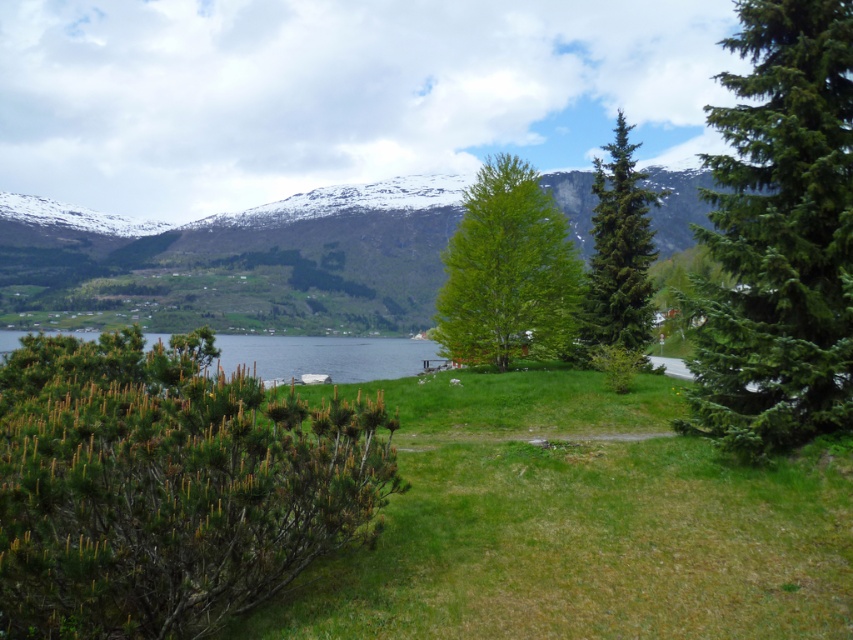
Question: Is green needle-like at left bigger than green coniferous tree at center?

Choices:
 (A) no
 (B) yes

Answer: (A)

Question: Is green needle-like at left thinner than green leafy tree at center?

Choices:
 (A) no
 (B) yes

Answer: (B)

Question: Is green needle-like at left bigger than green fir tree at right?

Choices:
 (A) yes
 (B) no

Answer: (B)

Question: Which point is farther to the camera?

Choices:
 (A) green grassy lake at lower left
 (B) green needle-like at left
 (C) green leafy tree at center
 (D) green coniferous tree at center

Answer: (C)

Question: Which of the following is the closest to the observer?

Choices:
 (A) green fir tree at right
 (B) green needle-like at left
 (C) green coniferous tree at center
 (D) green leafy tree at center

Answer: (B)

Question: Which is farther from the green needle-like at left?

Choices:
 (A) green coniferous tree at center
 (B) green fir tree at right
 (C) green leafy tree at center

Answer: (C)